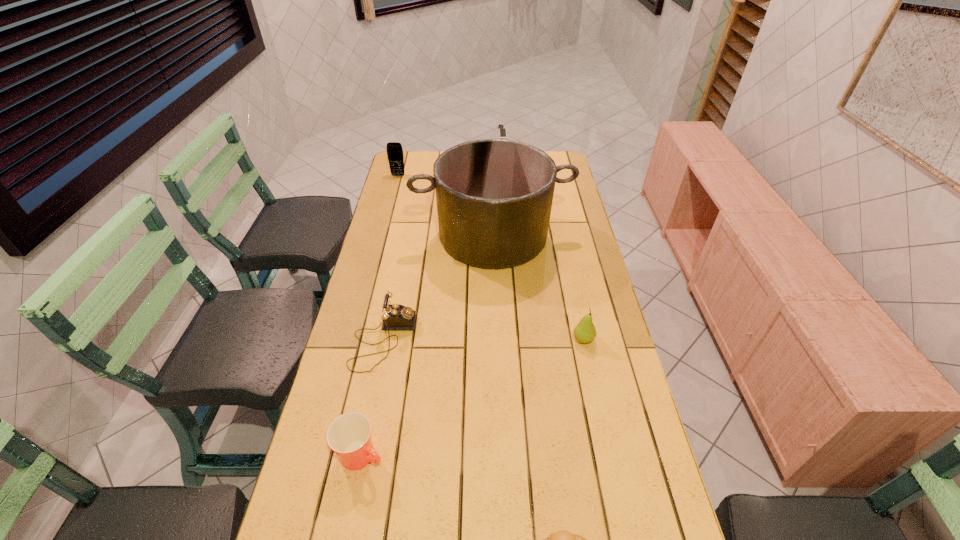
What are the coordinates of `pear at the right edge` in the screenshot? It's located at (585, 332).

Locate an element on the screen. object that is at the far left corner is located at coordinates (395, 156).

Find the location of a particular element. vacant space at the left edge of the desktop is located at coordinates (394, 285).

In the image, there is a desktop. Identify the location of vacant space at the right edge. The height and width of the screenshot is (540, 960). (612, 386).

Find the location of a particular element. This screenshot has width=960, height=540. vacant space at the far left corner of the desktop is located at coordinates (420, 155).

I want to click on blank space at the far right corner, so click(x=563, y=157).

Identify the location of empty space that is in between the cup and the cellular telephone. The image size is (960, 540). (380, 315).

Where is `free space between the pear and the telephone`? This screenshot has width=960, height=540. free space between the pear and the telephone is located at coordinates (484, 340).

Locate an element on the screen. The height and width of the screenshot is (540, 960). free point between the telephone and the tallest object is located at coordinates (438, 288).

Identify the location of vacant point located between the pear and the telephone. (484, 340).